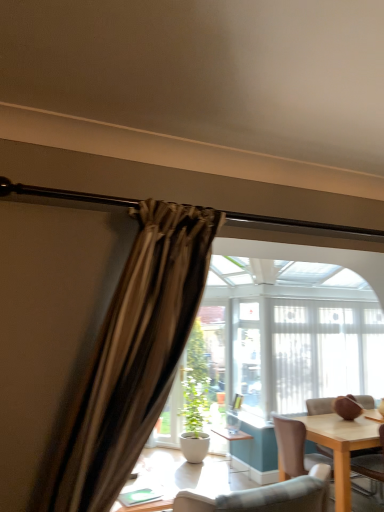
Question: Should I look upward or downward to see white sheer curtain at center?

Choices:
 (A) up
 (B) down

Answer: (B)

Question: Does wooden chair at right come behind white sheer curtain at center?

Choices:
 (A) yes
 (B) no

Answer: (B)

Question: Is wooden chair at right completely or partially outside of white sheer curtain at center?

Choices:
 (A) no
 (B) yes

Answer: (B)

Question: Is wooden chair at right positioned with its back to white sheer curtain at center?

Choices:
 (A) yes
 (B) no

Answer: (B)

Question: Is wooden chair at right smaller than white sheer curtain at center?

Choices:
 (A) no
 (B) yes

Answer: (B)

Question: Does wooden chair at right contain white sheer curtain at center?

Choices:
 (A) yes
 (B) no

Answer: (B)

Question: Does wooden chair at right appear on the left side of white sheer curtain at center?

Choices:
 (A) yes
 (B) no

Answer: (A)

Question: Is white matte pot at center smaller than wooden chair at right?

Choices:
 (A) yes
 (B) no

Answer: (B)

Question: Is white matte pot at center taller than wooden chair at right?

Choices:
 (A) yes
 (B) no

Answer: (A)

Question: Does white matte pot at center appear on the right side of wooden chair at right?

Choices:
 (A) yes
 (B) no

Answer: (B)

Question: Could you tell me if white matte pot at center is turned towards wooden chair at right?

Choices:
 (A) no
 (B) yes

Answer: (A)

Question: Is the depth of white matte pot at center less than that of wooden chair at right?

Choices:
 (A) no
 (B) yes

Answer: (A)

Question: Considering the relative sizes of white matte pot at center and wooden chair at right in the image provided, is white matte pot at center bigger than wooden chair at right?

Choices:
 (A) no
 (B) yes

Answer: (B)

Question: Does white matte pot at center have a lesser height compared to white sheer curtain at center?

Choices:
 (A) no
 (B) yes

Answer: (B)